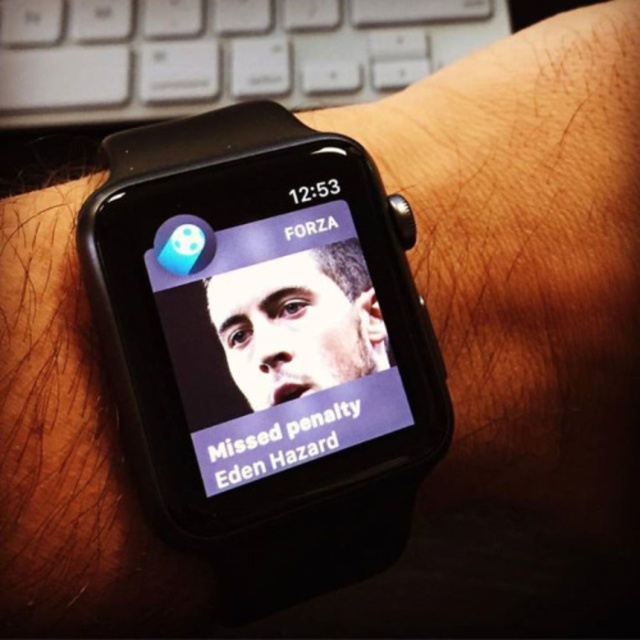
You are a photographer trying to capture a closeup of the black matte smartwatch at center and the white plastic keyboard at upper left. Which object should you focus on first if you want to ensure both are in focus without adjusting the camera settings?

The black matte smartwatch at center is positioned under the white plastic keyboard at upper left, so focusing on the white plastic keyboard at upper left first would help keep both in focus since it is closer to the camera.

You are a photographer trying to capture a close shot of the smartwatch. You notice two points on the watch screen at coordinates point (310, 284) and point (374, 285). Which point should you focus on to ensure the closest point is in sharp focus?

You should focus on point (310, 284) because it is closer to the camera than point (374, 285), ensuring it will be in sharp focus.